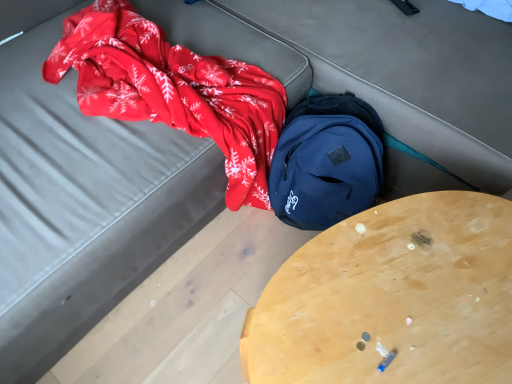
Locate an element on the screen. empty space that is ontop of wooden table at center is located at coordinates (413, 288).